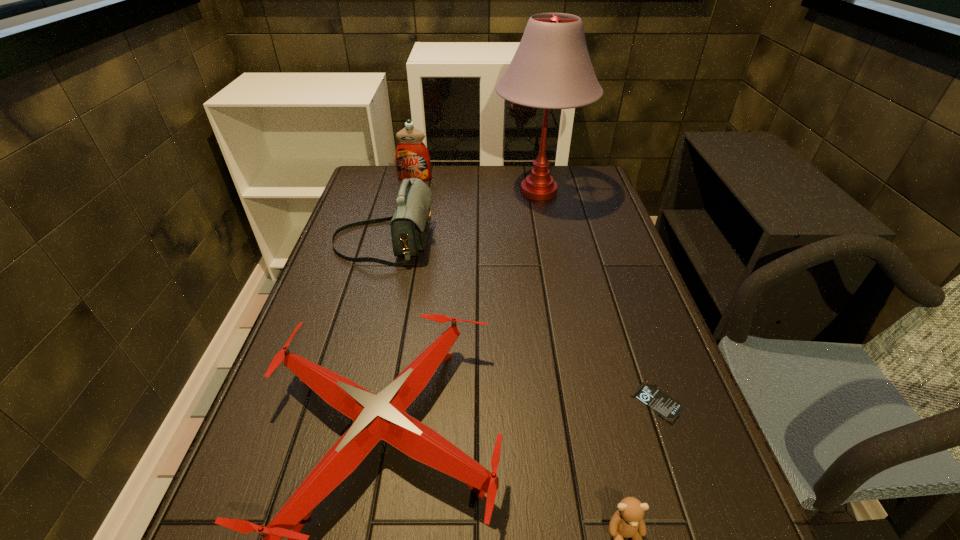
I want to click on table lamp, so click(551, 69).

Where is `the fifth shortest object`? the fifth shortest object is located at coordinates (412, 158).

Find the location of a particular element. the fourth shortest object is located at coordinates (410, 223).

The height and width of the screenshot is (540, 960). What are the coordinates of `shoulder bag` in the screenshot? It's located at (410, 223).

Where is `the shortest object`? This screenshot has width=960, height=540. the shortest object is located at coordinates (667, 408).

The image size is (960, 540). I want to click on vacant space situated 0.170m on the front-facing side of the table lamp, so pos(443,192).

At what (x,y) coordinates should I click in order to perform the action: click on free point located 0.130m on the front-facing side of the table lamp. Please return your answer as a coordinate pair (x, y). This screenshot has width=960, height=540. Looking at the image, I should click on (455, 192).

What are the coordinates of `blank space located 0.150m on the front-facing side of the table lamp` in the screenshot? It's located at (448, 192).

Locate an element on the screen. Image resolution: width=960 pixels, height=540 pixels. vacant space located on the front surface of the detergent is located at coordinates (409, 204).

Where is `vacant region located on the back of the shoulder bag`? vacant region located on the back of the shoulder bag is located at coordinates (394, 203).